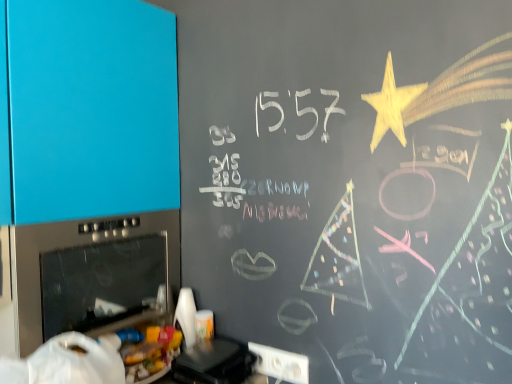
Find the location of a particular element. This screenshot has height=384, width=512. stainless steel oven at lower left is located at coordinates (94, 275).

In order to face stainless steel oven at lower left, should I rotate leftwards or rightwards?

Turn left approximately 21.794 degrees to face it.

The image size is (512, 384). What do you see at coordinates (94, 275) in the screenshot?
I see `stainless steel oven at lower left` at bounding box center [94, 275].

Where is `stainless steel oven at lower left`? The image size is (512, 384). stainless steel oven at lower left is located at coordinates (94, 275).